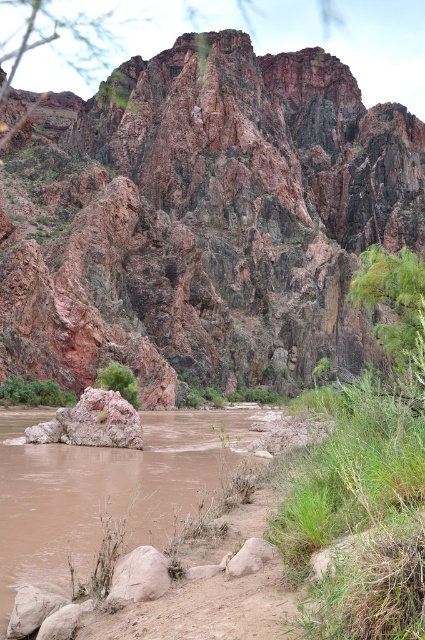
You are standing at the point marked by point (368, 474) in the image. Which direction should you go to reach the green grass at right?

The point (368, 474) is where the green grass at right is located, so you are already there.

You are standing at the edge of the canyon and notice both the green grass at lower left and the green leafy bush at center. Which of these two plants is closer to your current position?

The green grass at lower left is closer to your current position because it is located below the green leafy bush at center, meaning it is situated nearer to the observer.

You are a hiker trying to cross the muddy river in the canyon. You see green grass at right and a green leafy bush at center. Which direction should you head towards to find a stable path?

You should head towards the green leafy bush at center because the green grass at right is located to the right of it, suggesting the bush might be on a more stable part of the riverbank.